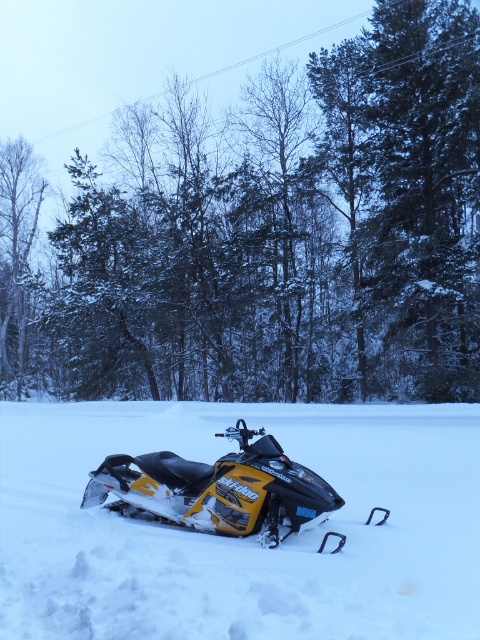
Question: Does yellow matte snowmobile at center appear on the right side of smooth white tree at left?

Choices:
 (A) no
 (B) yes

Answer: (B)

Question: Which object appears farthest from the camera in this image?

Choices:
 (A) yellow matte snowmobile at center
 (B) yellow plastic snowmobile at center

Answer: (A)

Question: Which of the following is the farthest from the observer?

Choices:
 (A) yellow matte snowmobile at center
 (B) yellow plastic snowmobile at center
 (C) snow-covered evergreen tree at center
 (D) smooth white tree at left

Answer: (D)

Question: Can you confirm if yellow matte snowmobile at center is positioned to the left of smooth white tree at left?

Choices:
 (A) yes
 (B) no

Answer: (B)

Question: Which of the following is the closest to the observer?

Choices:
 (A) snow-covered evergreen tree at center
 (B) smooth white tree at left
 (C) yellow matte snowmobile at center

Answer: (C)

Question: Is the position of snow-covered evergreen tree at center less distant than that of yellow matte snowmobile at center?

Choices:
 (A) no
 (B) yes

Answer: (A)